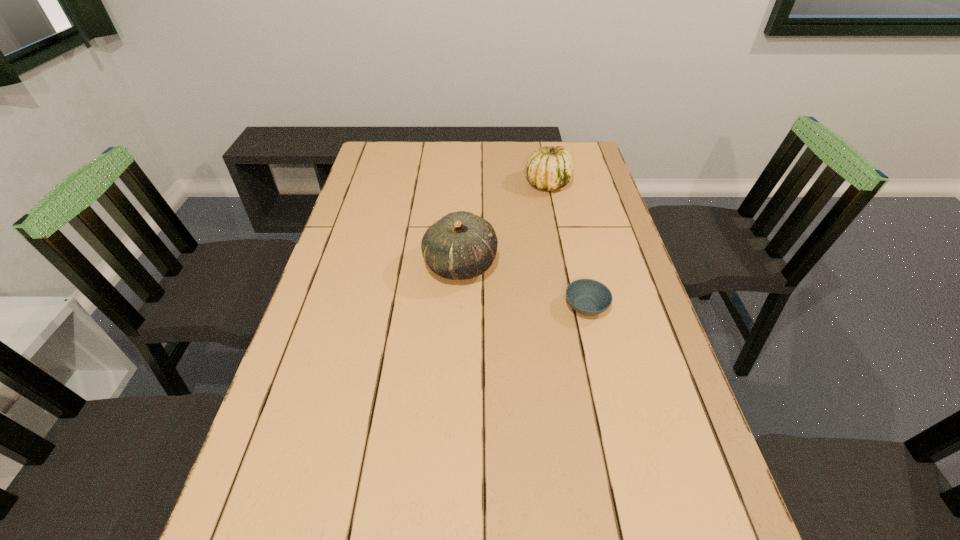
Locate an element on the screen. soup bowl at the right edge is located at coordinates (588, 297).

At what (x,y) coordinates should I click in order to perform the action: click on object that is positioned at the far right corner. Please return your answer as a coordinate pair (x, y). This screenshot has width=960, height=540. Looking at the image, I should click on (549, 168).

Find the location of a particular element. This screenshot has height=540, width=960. vacant region at the far edge of the desktop is located at coordinates (499, 166).

The width and height of the screenshot is (960, 540). Identify the location of free spot at the left edge of the desktop. (318, 366).

I want to click on free space at the right edge, so click(629, 279).

Locate an element on the screen. The height and width of the screenshot is (540, 960). free spot between the soup bowl and the right gourd is located at coordinates (567, 245).

The width and height of the screenshot is (960, 540). I want to click on free area in between the shorter gourd and the soup bowl, so click(x=567, y=245).

Where is `free space between the second tallest object and the shortest object`? Image resolution: width=960 pixels, height=540 pixels. free space between the second tallest object and the shortest object is located at coordinates (567, 245).

The height and width of the screenshot is (540, 960). Find the location of `empty location between the nearer gourd and the shortest object`. empty location between the nearer gourd and the shortest object is located at coordinates (523, 286).

Locate an element on the screen. This screenshot has width=960, height=540. free space between the shorter gourd and the nearer gourd is located at coordinates (504, 224).